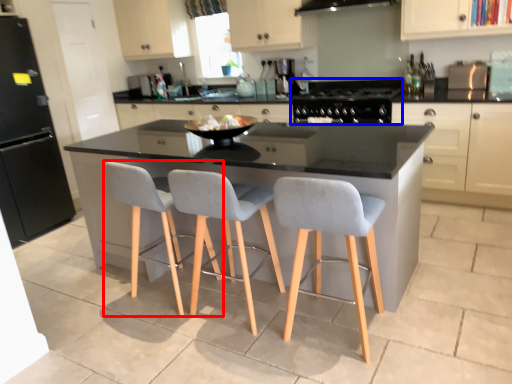
Question: Which of the following is the closest to the observer, chair (highlighted by a red box) or gas stove (highlighted by a blue box)?

Choices:
 (A) chair
 (B) gas stove

Answer: (A)